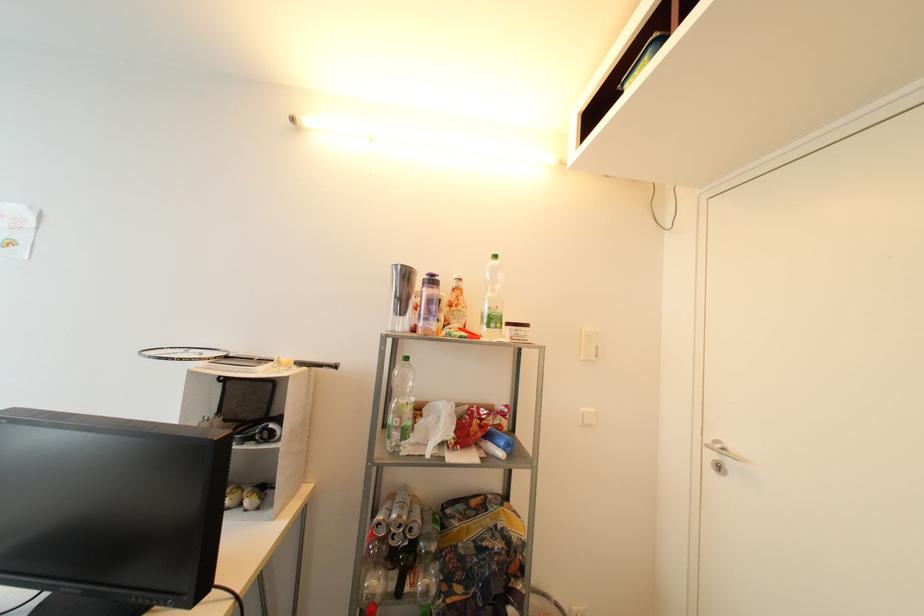
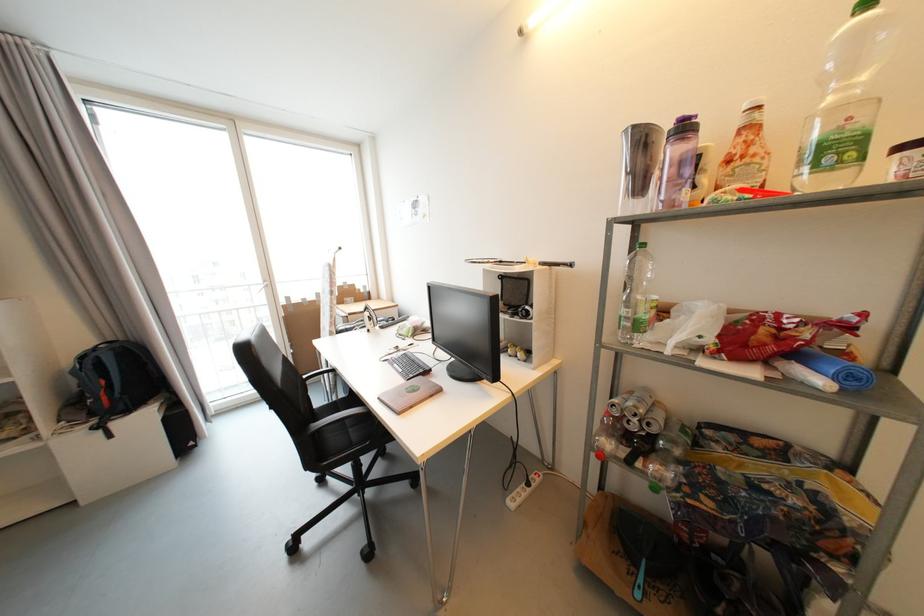
Question: The camera is either moving clockwise (left) or counter-clockwise (right) around the object. The first image is from the beginning of the video and the second image is from the end. Is the camera moving left or right when shooting the video?

Choices:
 (A) Left
 (B) Right

Answer: (B)